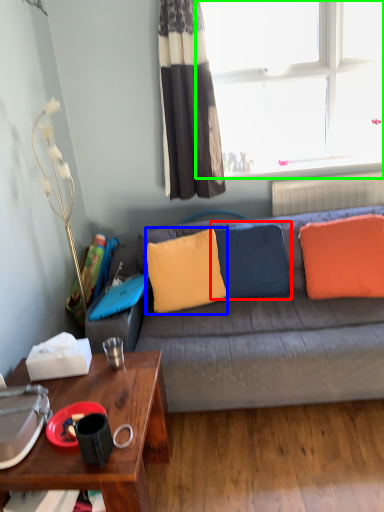
Question: Estimate the real-world distances between objects in this image. Which object is farther from pillow (highlighted by a red box), pillow (highlighted by a blue box) or window (highlighted by a green box)?

Choices:
 (A) pillow
 (B) window

Answer: (B)